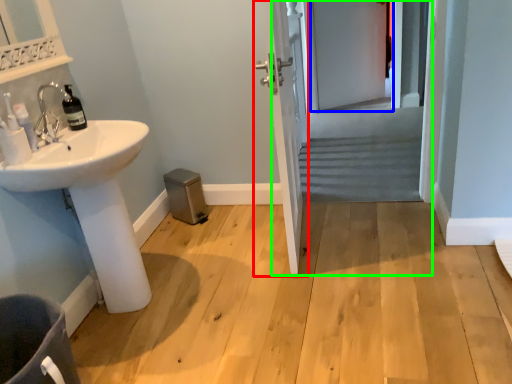
Question: Which object is positioned farthest from door (highlighted by a red box)? Select from screen door (highlighted by a blue box) and screen door (highlighted by a green box).

Choices:
 (A) screen door
 (B) screen door

Answer: (A)